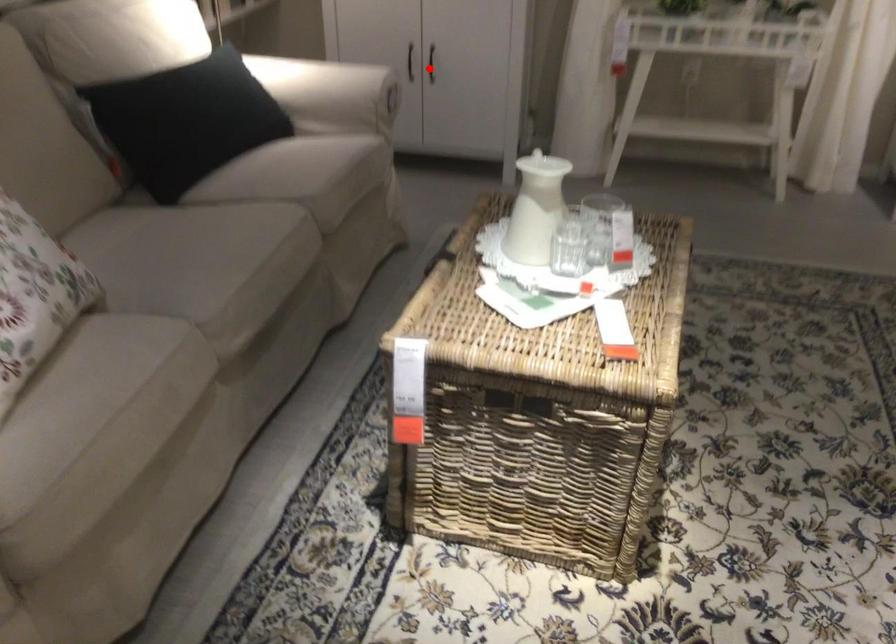
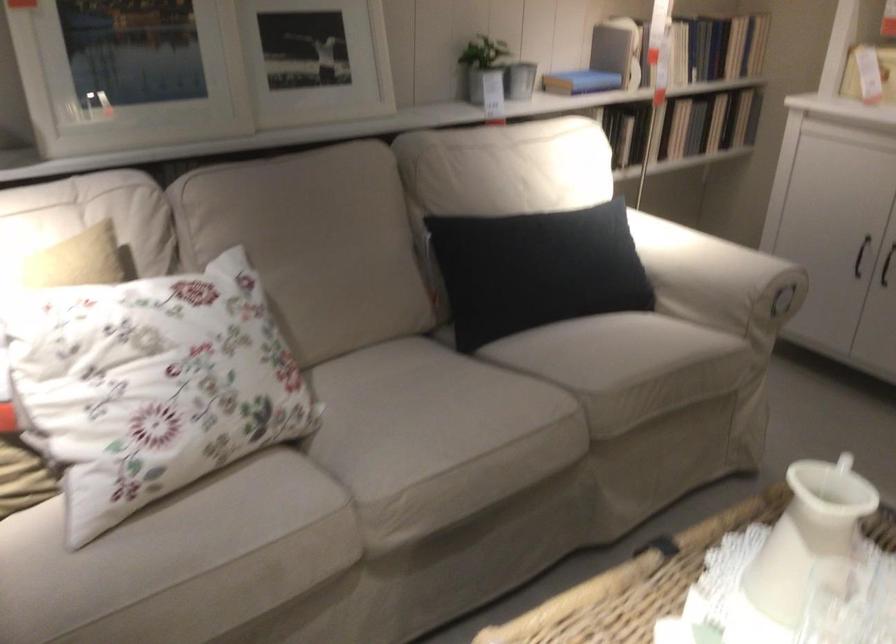
Question: I am providing you with two images of the same scene from different viewpoints. A red point is shown in image1. For the corresponding object point in image2, is it positioned nearer or farther from the camera?

Choices:
 (A) Nearer
 (B) Farther

Answer: (A)